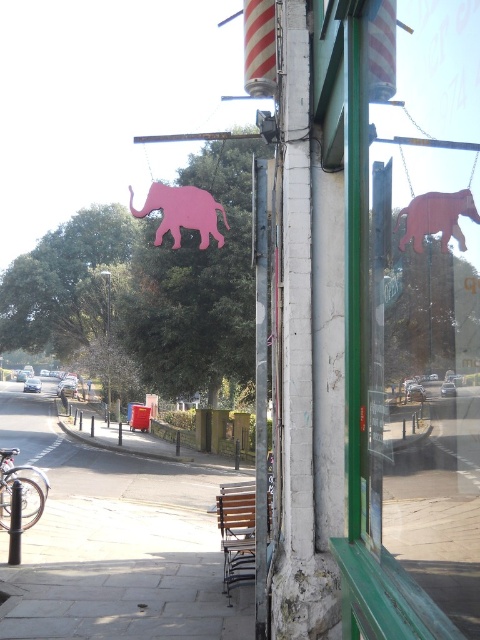
Is pink matte elephant at upper center below wooden elephant at upper right?

Actually, pink matte elephant at upper center is above wooden elephant at upper right.

Who is taller, pink matte elephant at upper center or wooden elephant at upper right?

pink matte elephant at upper center is taller.

Which is behind, point (215, 214) or point (410, 228)?

The point (215, 214) is more distant.

Locate an element on the screen. This screenshot has height=640, width=480. pink matte elephant at upper center is located at coordinates pos(181,212).

Can you confirm if pink matte elephant at center is positioned above paved concrete sidewalk at lower left?

Indeed, pink matte elephant at center is positioned over paved concrete sidewalk at lower left.

Is point (409, 257) closer to camera compared to point (61, 480)?

Yes, point (409, 257) is closer to viewer.

At what (x,y) coordinates should I click in order to perform the action: click on pink matte elephant at center. Please return your answer as a coordinate pair (x, y). The width and height of the screenshot is (480, 640). Looking at the image, I should click on (400, 356).

Is pink matte elephant at center smaller than wooden elephant at upper right?

Actually, pink matte elephant at center might be larger than wooden elephant at upper right.

Who is more forward, (433, 472) or (457, 195)?

Positioned in front is point (457, 195).

At what (x,y) coordinates should I click in order to perform the action: click on pink matte elephant at center. Please return your answer as a coordinate pair (x, y). Looking at the image, I should click on (400, 356).